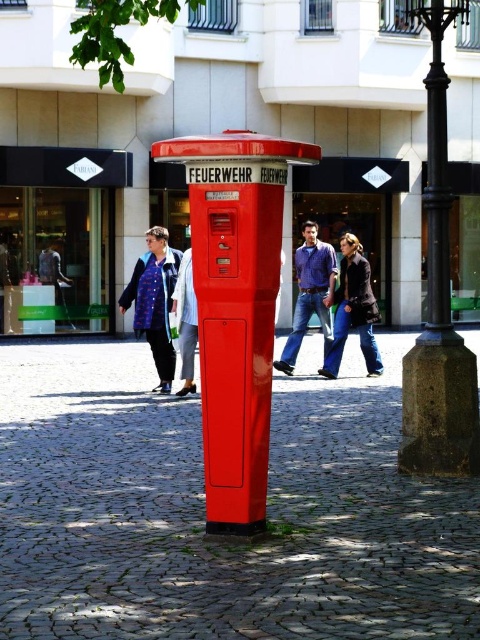
You are a tourist in a European city and see the matte red fire alarm at center and the blue plaid coat at center. Which object is positioned to the right side from your perspective?

The matte red fire alarm at center is positioned to the right of the blue plaid coat at center.

You are standing at the point marked as point [439,304] in the image. What object are you standing on?

The point [439,304] corresponds to the black metal pole at right.

You are a customer in a clothing store and see the dark blue jeans at center and the blue denim jacket at center displayed on a mannequin. Which item takes up more horizontal space on the display?

The dark blue jeans at center has a larger width than the blue denim jacket at center, so the dark blue jeans at center takes up more horizontal space on the display.